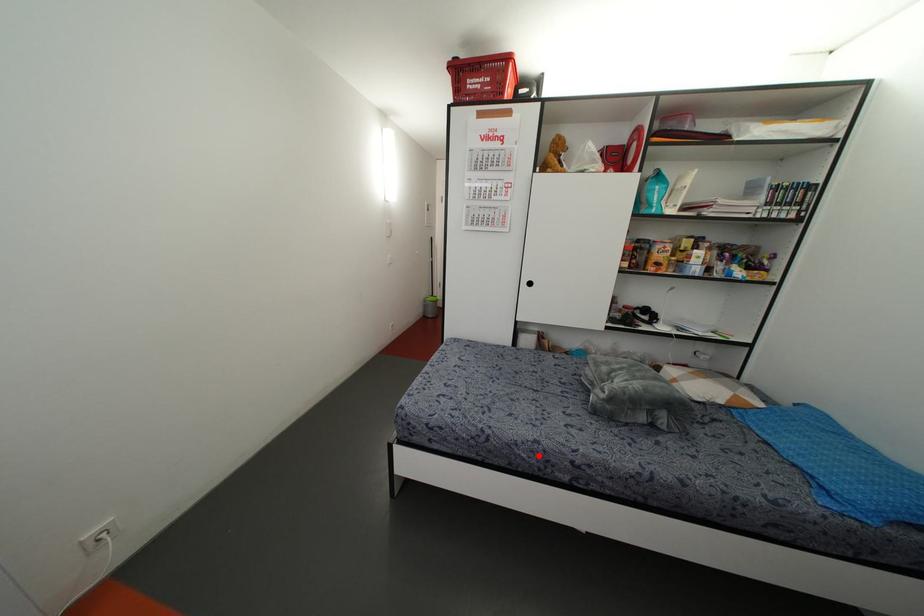
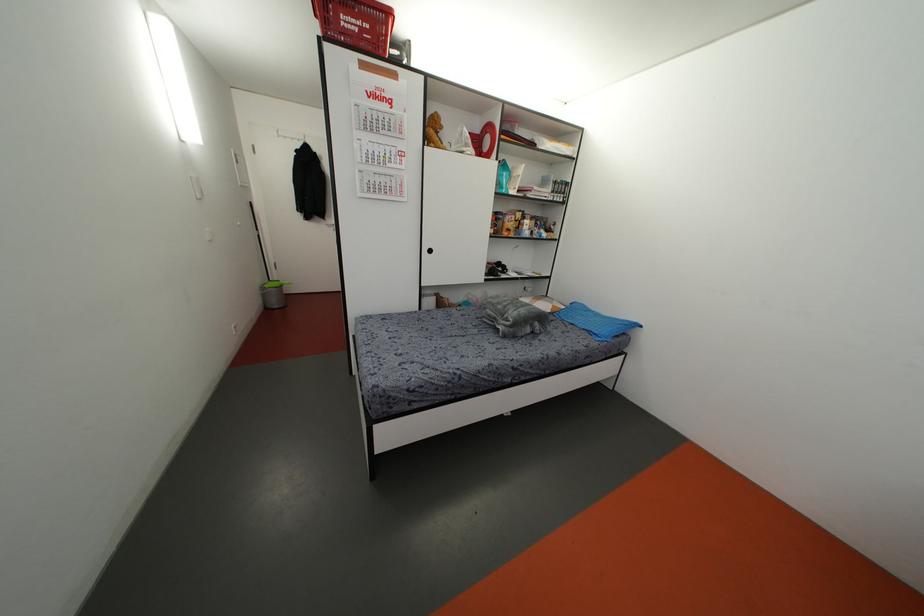
Locate, in the second image, the point that corresponds to the highlighted location in the first image.

(493, 373)